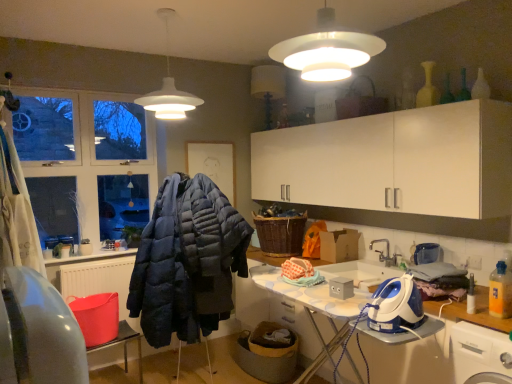
The width and height of the screenshot is (512, 384). Find the location of `empty space that is ontop of white matte lampshade at upper center, the second lamp from the right (from a real-world perspective)`. empty space that is ontop of white matte lampshade at upper center, the second lamp from the right (from a real-world perspective) is located at coordinates (169, 9).